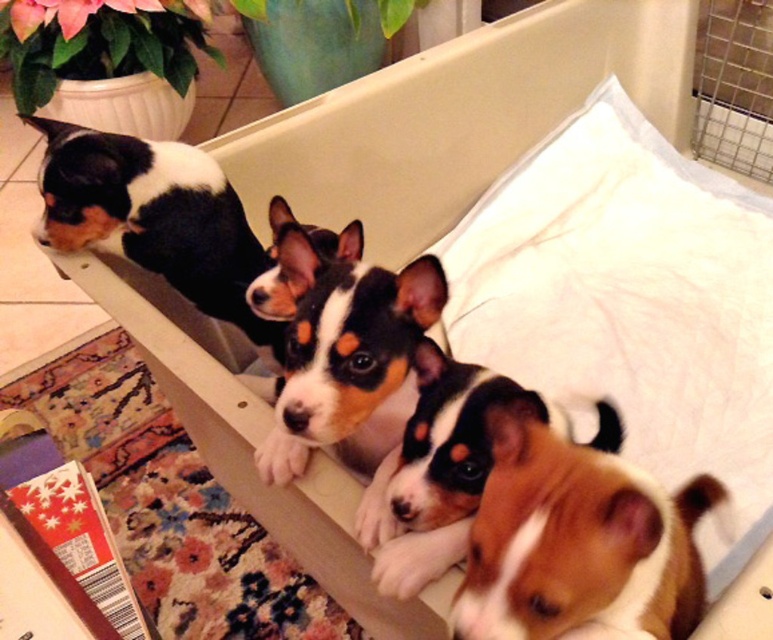
You are a photographer trying to capture a photo of the brown furry dog at lower right and the black and white fur at center. Which dog should you adjust your camera angle to look up at?

You should adjust your camera angle to look up at the black and white fur at center because the brown furry dog at lower right has a lesser height compared to black and white fur at center.

You are a photographer trying to capture a closeup of the black and white fur at center and the black and white fur at upper left. How far apart are these two areas of fur?

The black and white fur at center is 10.32 inches from the black and white fur at upper left.

You are a veterinarian who needs to examine the brown furry dog at lower right. You are standing 1 meter away from the dog. Can you safely reach the dog without moving closer than 45 centimeters? Please explain your reasoning.

The brown furry dog at lower right and the viewer are 47.71 centimeters apart. Since you are standing 1 meter away, which is farther than the required 45 centimeters, you can safely reach the dog without moving closer than 45 centimeters.